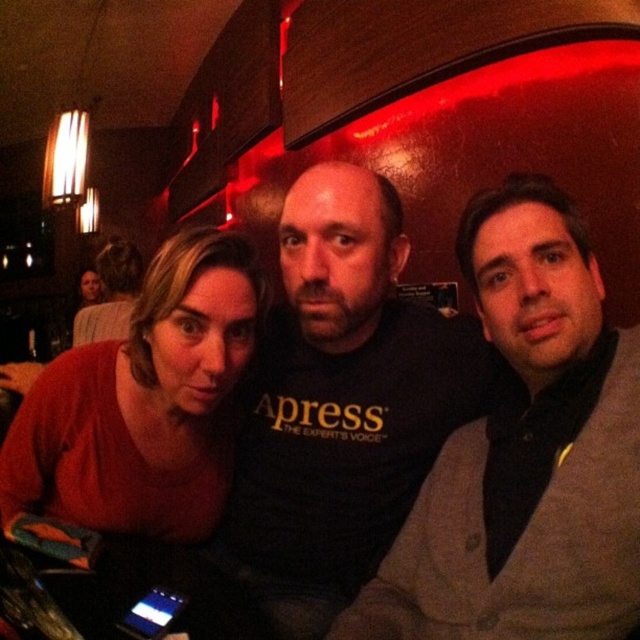
Does black t-shirt at center have a greater width compared to matte red sweater at lower left?

Yes, black t-shirt at center is wider than matte red sweater at lower left.

Can you confirm if black t-shirt at center is taller than matte red sweater at lower left?

Correct, black t-shirt at center is much taller as matte red sweater at lower left.

The height and width of the screenshot is (640, 640). In order to click on black t-shirt at center in this screenshot , I will do `click(342, 404)`.

Does gray sweater at center have a lesser height compared to black t-shirt at center?

Correct, gray sweater at center is not as tall as black t-shirt at center.

Looking at this image, is gray sweater at center to the right of black t-shirt at center from the viewer's perspective?

Yes, gray sweater at center is to the right of black t-shirt at center.

Does point (628, 596) come closer to viewer compared to point (371, 323)?

Yes, it is.

The image size is (640, 640). Identify the location of gray sweater at center. (525, 452).

Identify the location of gray sweater at center. (525, 452).

Where is `gray sweater at center`? gray sweater at center is located at coordinates (525, 452).